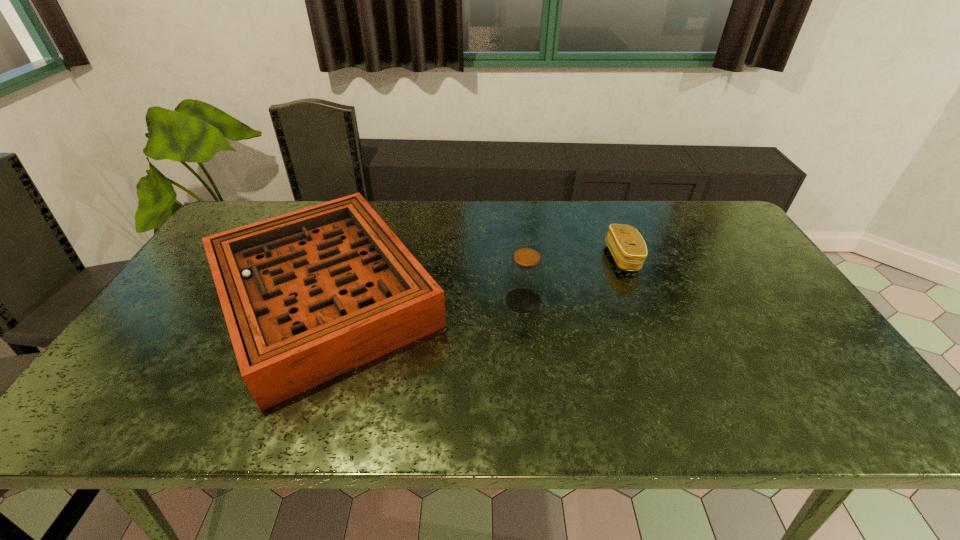
Find the location of `free space located 0.100m on the zipper side of the clutch bag`. free space located 0.100m on the zipper side of the clutch bag is located at coordinates (575, 258).

Where is `gameboard present at the far edge`? The height and width of the screenshot is (540, 960). gameboard present at the far edge is located at coordinates (309, 295).

Identify the location of clutch bag at the far edge. This screenshot has width=960, height=540. (626, 244).

Where is `object that is at the near edge`? object that is at the near edge is located at coordinates (309, 295).

The height and width of the screenshot is (540, 960). I want to click on object that is at the left edge, so click(309, 295).

You are a GUI agent. You are given a task and a screenshot of the screen. Output one action in this format:
    pyautogui.click(x=<x>, y=<y>)
    Task: Click on the object positioned at the far left corner
    
    Given the screenshot: What is the action you would take?
    pyautogui.click(x=309, y=295)

Identify the location of object at the near left corner. (309, 295).

The height and width of the screenshot is (540, 960). In the image, there is a desktop. Identify the location of vacant area at the far edge. (591, 233).

Find the location of a particular element. vacant space at the near edge is located at coordinates (504, 426).

Locate an element on the screen. free spot at the right edge of the desktop is located at coordinates (801, 390).